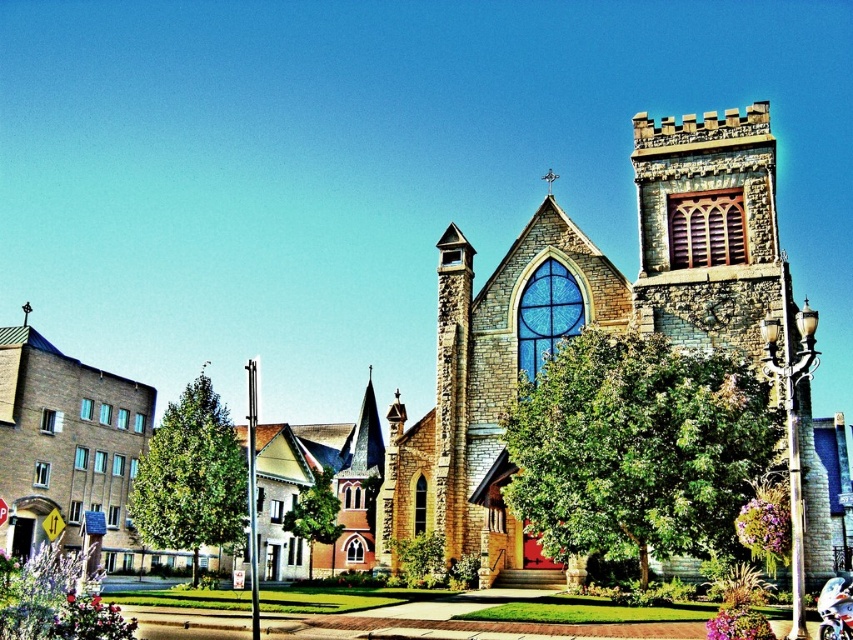
Question: Which of the following is the closest to the observer?

Choices:
 (A) stone church at center
 (B) metallic blue motorcycle at lower right

Answer: (B)

Question: Is stone church at center to the right of metallic blue motorcycle at lower right from the viewer's perspective?

Choices:
 (A) yes
 (B) no

Answer: (A)

Question: Can you confirm if stone church at center is positioned to the right of metallic blue motorcycle at lower right?

Choices:
 (A) yes
 (B) no

Answer: (A)

Question: Is the position of stone church at center less distant than that of metallic blue motorcycle at lower right?

Choices:
 (A) yes
 (B) no

Answer: (B)